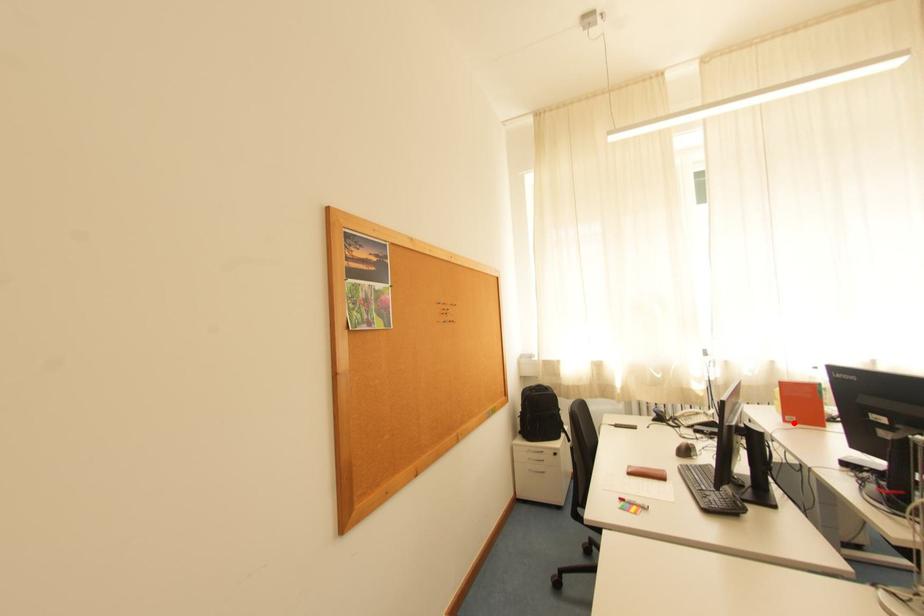
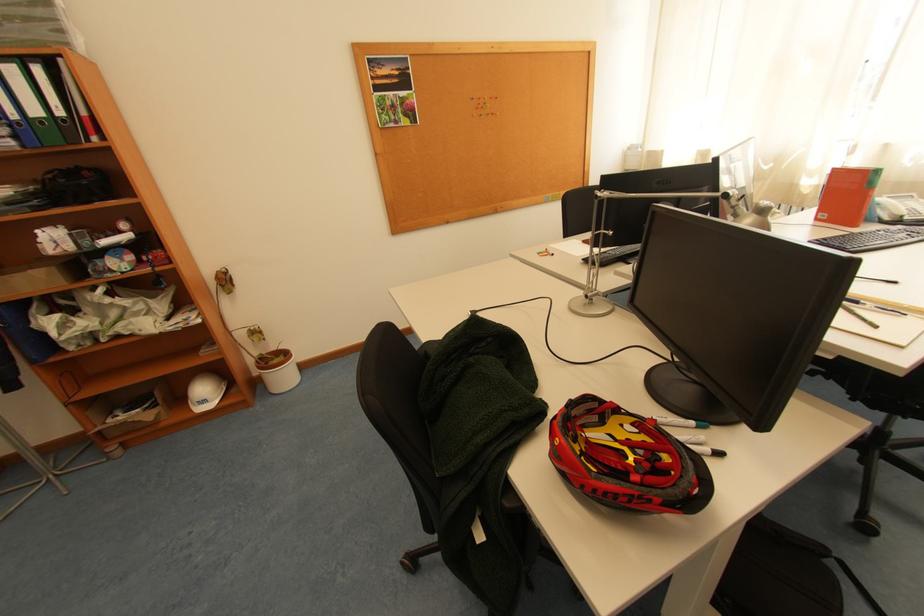
The point at the highlighted location is marked in the first image. Where is the corresponding point in the second image?

(824, 220)